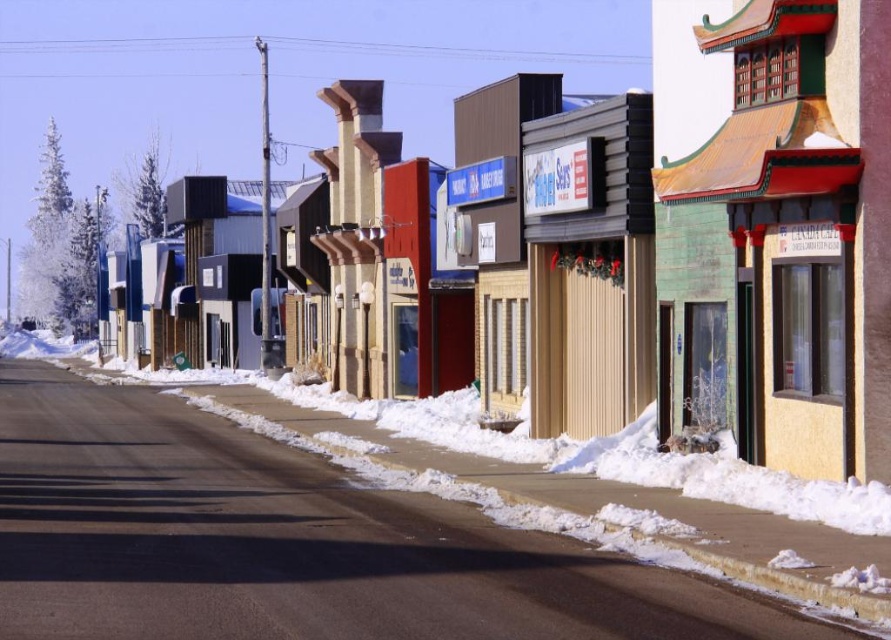
Question: Is white powdery snow at center to the right of green wooden building at center from the viewer's perspective?

Choices:
 (A) no
 (B) yes

Answer: (A)

Question: Which of the following is the farthest from the observer?

Choices:
 (A) white powdery snow at center
 (B) green wooden building at center

Answer: (B)

Question: Which point is closer to the camera?

Choices:
 (A) (462, 589)
 (B) (845, 76)

Answer: (A)

Question: Which object appears closest to the camera in this image?

Choices:
 (A) white powdery snow at center
 (B) green wooden building at center

Answer: (A)

Question: Where is white powdery snow at center located in relation to green wooden building at center in the image?

Choices:
 (A) above
 (B) below

Answer: (B)

Question: Where is white powdery snow at center located in relation to green wooden building at center in the image?

Choices:
 (A) left
 (B) right

Answer: (A)